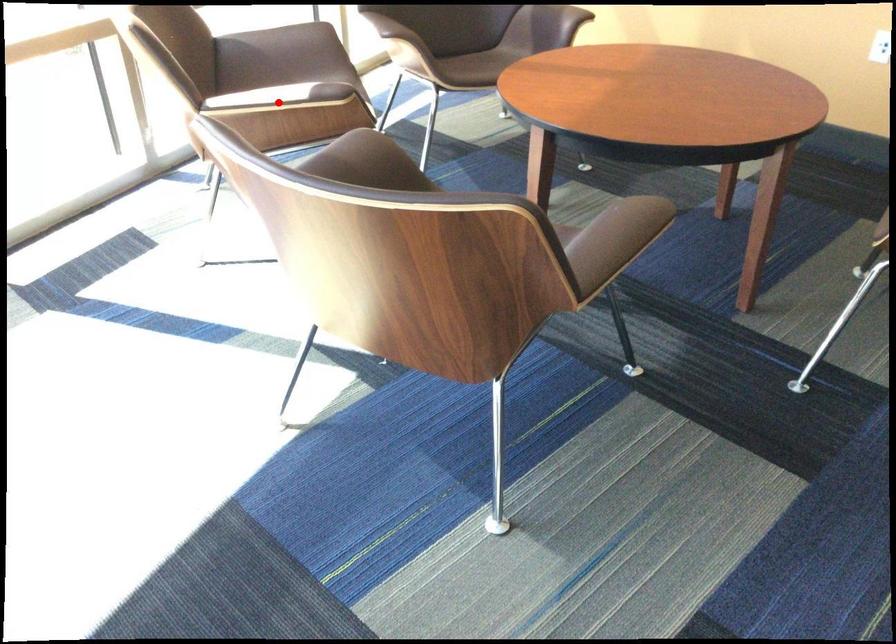
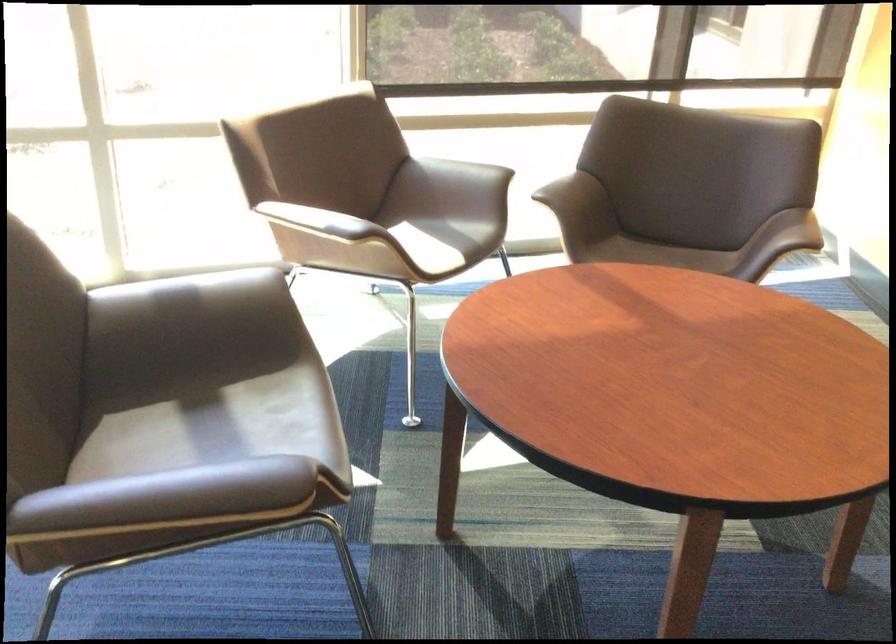
The point at the highlighted location is marked in the first image. Where is the corresponding point in the second image?

(314, 221)